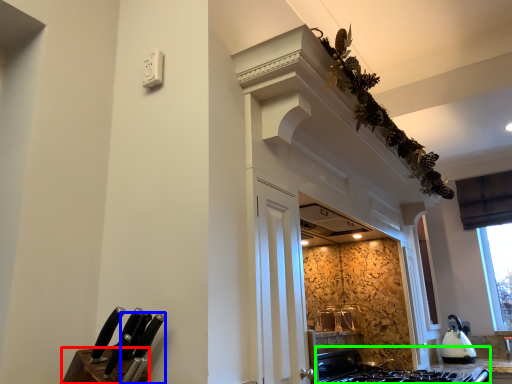
Question: Which object is positioned closest to cabinetry (highlighted by a red box)? Select from knife (highlighted by a blue box) and gas stove (highlighted by a green box).

Choices:
 (A) knife
 (B) gas stove

Answer: (A)